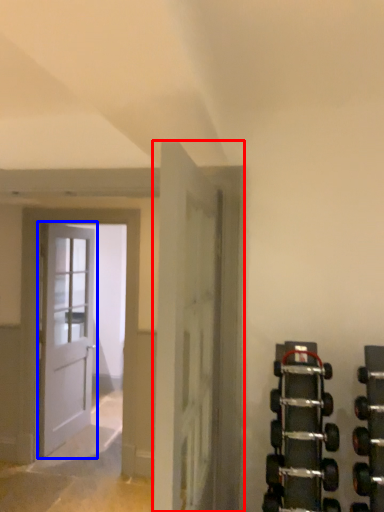
Question: Which of the following is the closest to the observer, door (highlighted by a red box) or door (highlighted by a blue box)?

Choices:
 (A) door
 (B) door

Answer: (A)